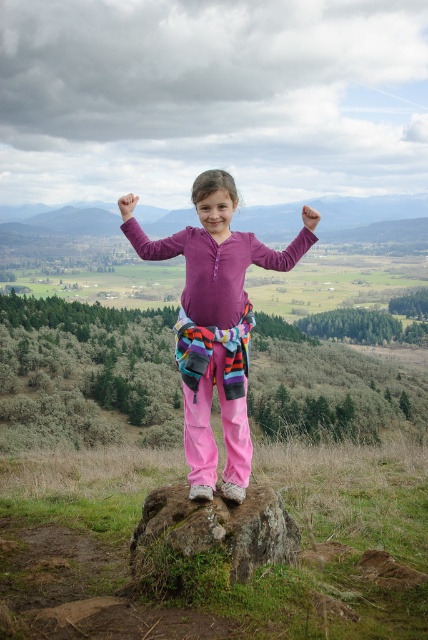
The girl in the image is wearing a purple matte shirt at center and has a purple fleece arm at center. If she wants to touch her shirt with her arm, which direction should she move her arm?

The purple fleece arm at center should move to the left to reach the purple matte shirt at center since the shirt is positioned to the left of the arm.

You are a photographer trying to capture the girl in the scene. You need to focus on the matte purple sweater at center. What are the coordinates to set your camera focus point to?

The coordinates to set your camera focus point to are (x=216, y=326).